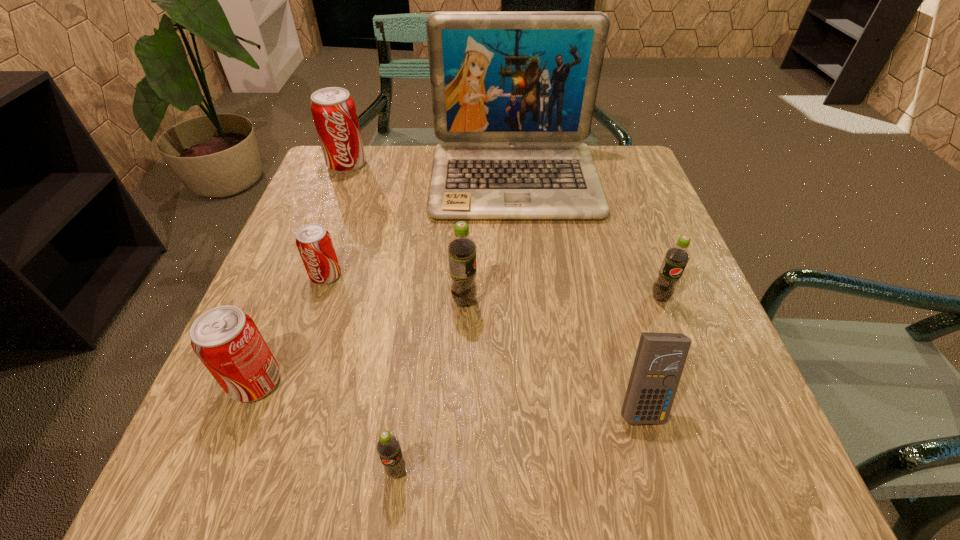
Find the location of `the tallest object`. the tallest object is located at coordinates (513, 93).

Identify the location of the farthest red soda can. (333, 110).

In order to click on the farthest soda in this screenshot , I will do `click(333, 110)`.

Identify the location of the biggest green soda. (462, 248).

At what (x,y) coordinates should I click in order to perform the action: click on the second green soda from right to left. Please return your answer as a coordinate pair (x, y). The image size is (960, 540). Looking at the image, I should click on (462, 248).

The image size is (960, 540). In order to click on the rightmost object in this screenshot , I will do `click(676, 258)`.

Where is `the rightmost soda`? This screenshot has height=540, width=960. the rightmost soda is located at coordinates (676, 258).

This screenshot has height=540, width=960. I want to click on the nearest red soda can, so click(227, 341).

Find the location of a particular element. the fifth farthest soda is located at coordinates (227, 341).

Where is `calculator`? This screenshot has width=960, height=540. calculator is located at coordinates tap(660, 358).